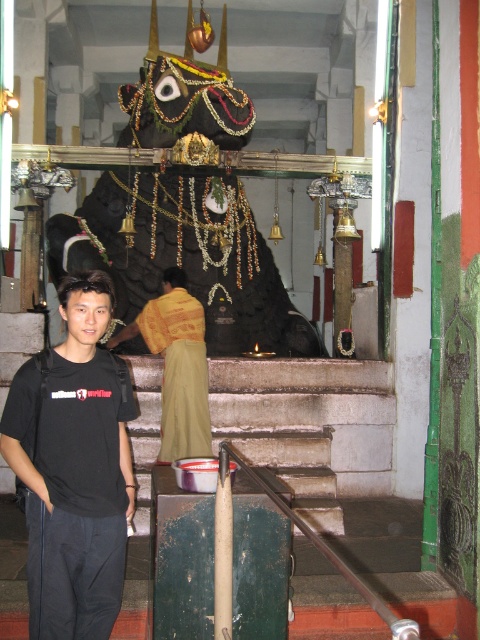
Can you confirm if black cotton shirt at lower left is smaller than yellow textured cloth at center?

Correct, black cotton shirt at lower left occupies less space than yellow textured cloth at center.

Measure the distance between black cotton shirt at lower left and yellow textured cloth at center.

black cotton shirt at lower left and yellow textured cloth at center are 11.08 meters apart from each other.

The image size is (480, 640). Identify the location of black cotton shirt at lower left. (73, 467).